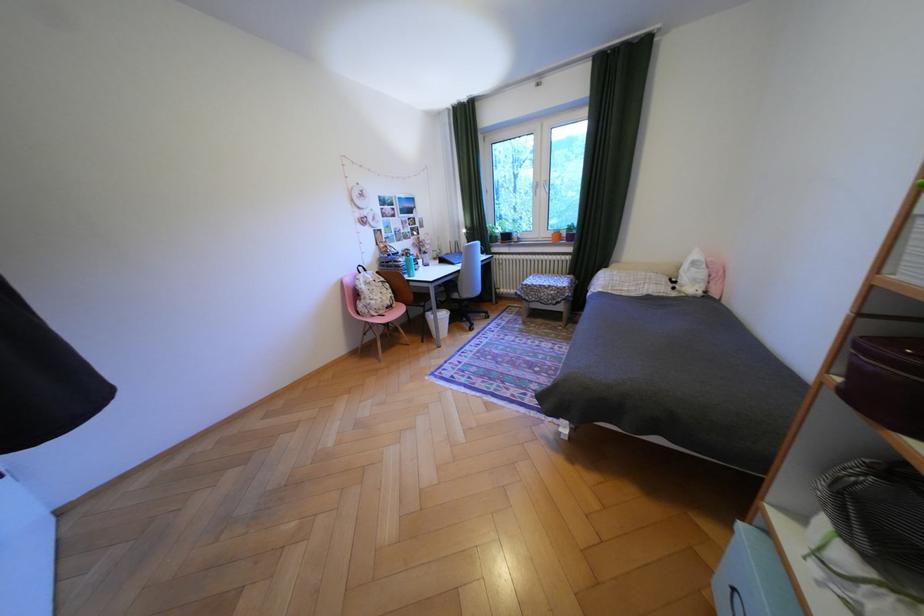
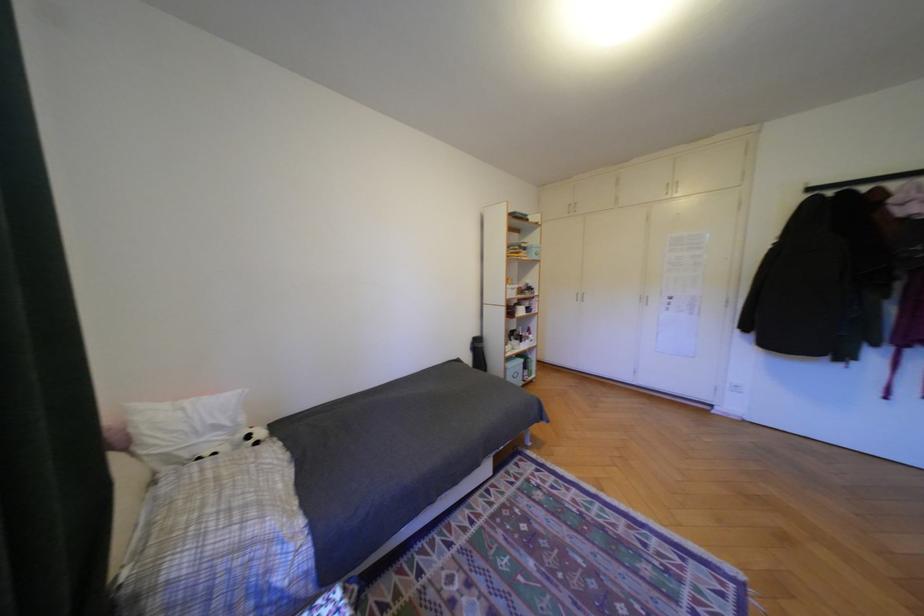
Where in the second image is the point corresponding to point 687,282 from the first image?

(261, 437)